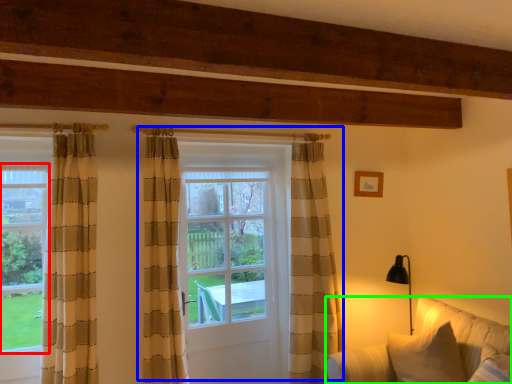
Question: Estimate the real-world distances between objects in this image. Which object is closer to bay window (highlighted by a red box), door (highlighted by a blue box) or studio couch (highlighted by a green box)?

Choices:
 (A) door
 (B) studio couch

Answer: (A)